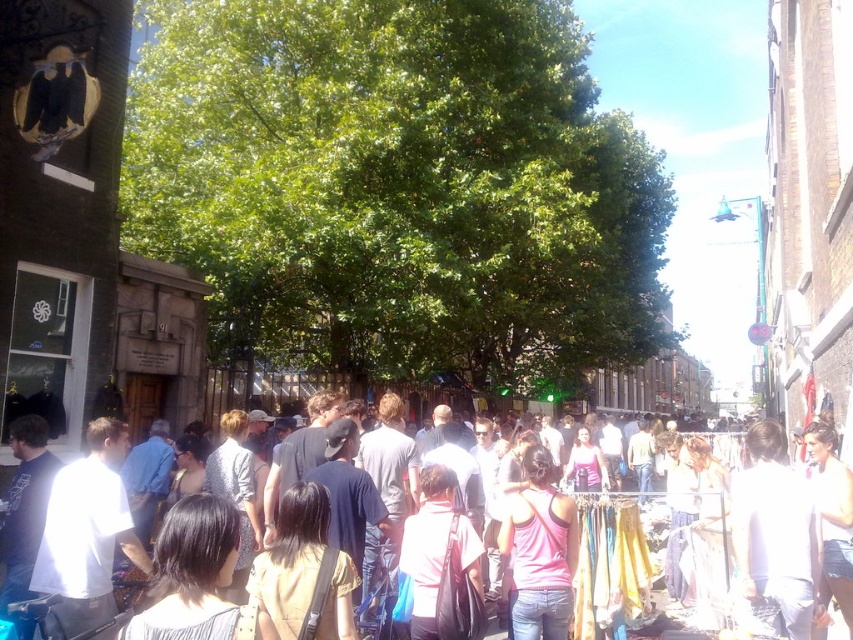
You are standing on the street and see two points marked in the image. Which point is nearer to you, point [813,506] or point [367,573]?

Point [813,506] is closer to the viewer than point [367,573].

You are a fashion designer observing a street scene. You notice two clothing items in the image. The white matte shirt at right and the pink matte tank top at center. Which clothing item appears taller in the image?

The white matte shirt at right appears taller than the pink matte tank top at center.